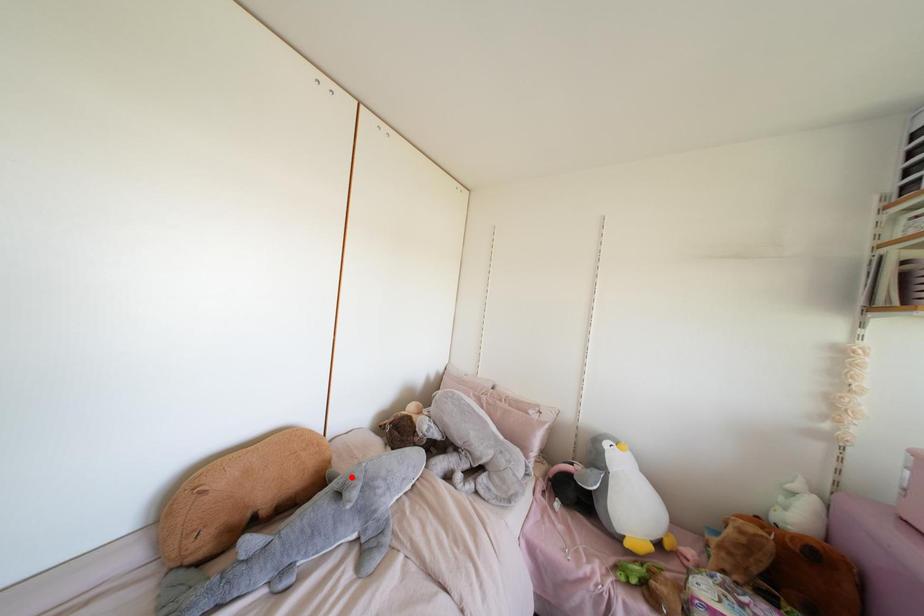
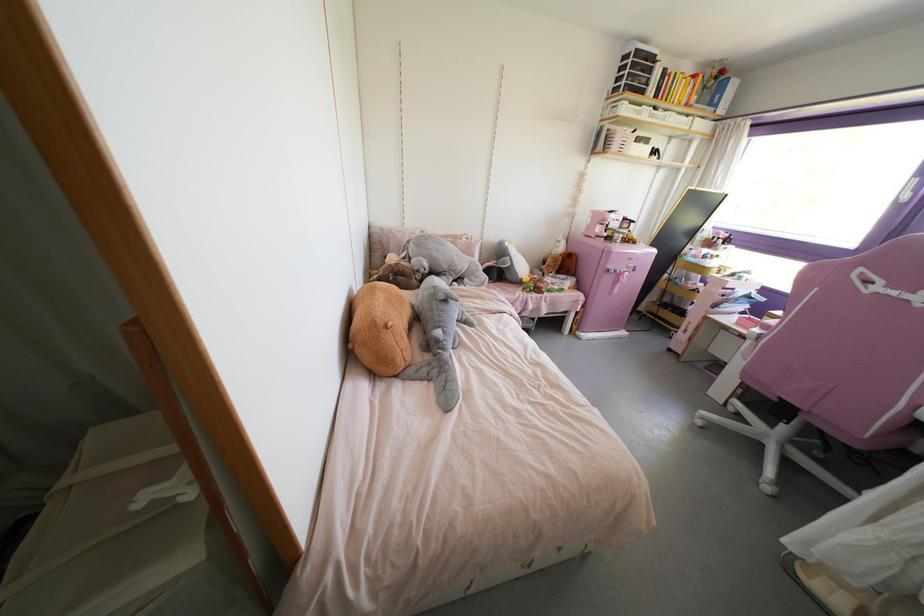
Question: I am providing you with two images of the same scene from different viewpoints. Given a red point in image1, look at the same physical point in image2. Is it:

Choices:
 (A) Closer to the viewpoint
 (B) Farther from the viewpoint

Answer: (B)